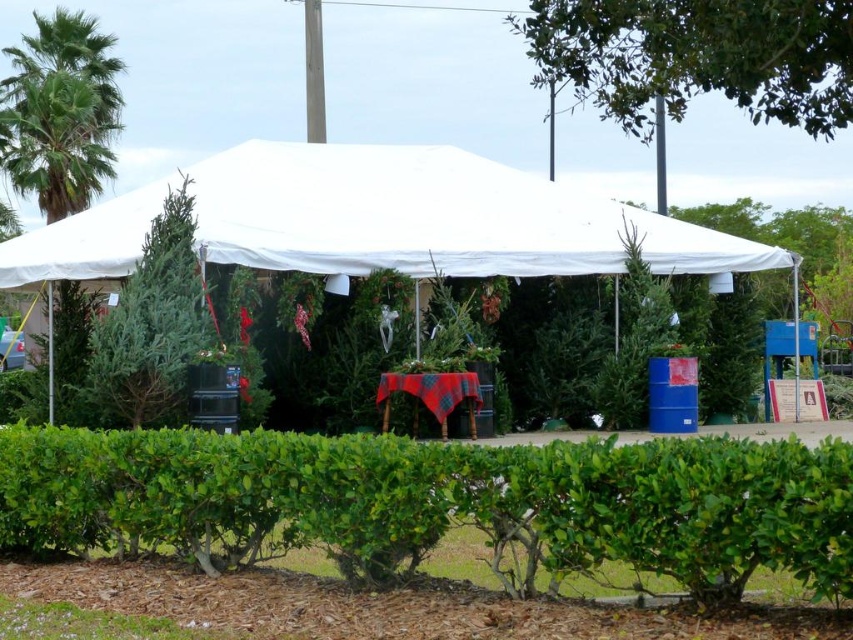
Question: Among these objects, which one is farthest from the camera?

Choices:
 (A) green leafy hedge at center
 (B) black plastic pole at upper right

Answer: (B)

Question: Among these points, which one is farthest from the camera?

Choices:
 (A) (318, 168)
 (B) (659, 211)

Answer: (B)

Question: Where is green leafy tree at upper center located in relation to green leafy palm tree at upper left in the image?

Choices:
 (A) above
 (B) below

Answer: (B)

Question: Which of the following is the closest to the observer?

Choices:
 (A) green leafy hedge at center
 (B) black plastic pole at upper right
 (C) green leafy tree at upper center
 (D) white fabric tent at center

Answer: (A)

Question: Can you confirm if green leafy hedge at center is positioned above green leafy tree at upper center?

Choices:
 (A) yes
 (B) no

Answer: (B)

Question: Is green leafy hedge at center further to the viewer compared to black plastic pole at upper right?

Choices:
 (A) yes
 (B) no

Answer: (B)